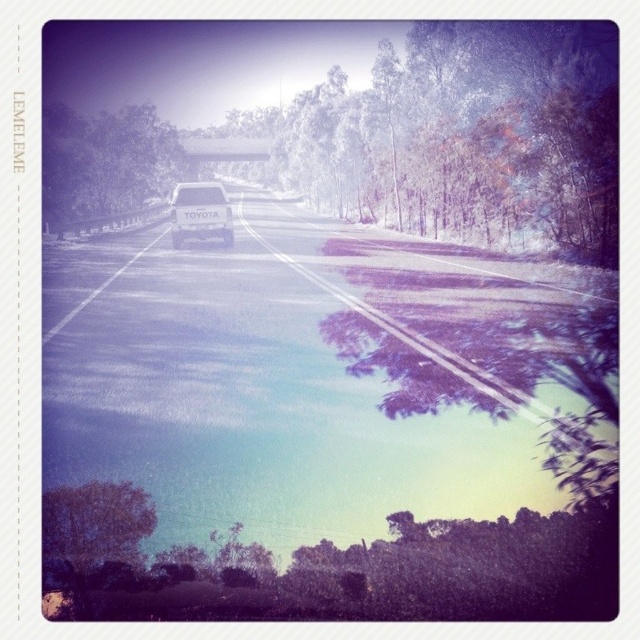
Question: Is green leafy tree at left positioned in front of matte white car at center?

Choices:
 (A) no
 (B) yes

Answer: (A)

Question: Which point is closer to the camera taking this photo?

Choices:
 (A) (220, 211)
 (B) (77, 212)

Answer: (A)

Question: Which of the following is the farthest from the observer?

Choices:
 (A) matte white car at center
 (B) green leafy tree at left

Answer: (B)

Question: Can you confirm if green leafy tree at left is wider than matte white car at center?

Choices:
 (A) no
 (B) yes

Answer: (B)

Question: Can you confirm if green leafy tree at left is positioned to the right of matte white car at center?

Choices:
 (A) yes
 (B) no

Answer: (B)